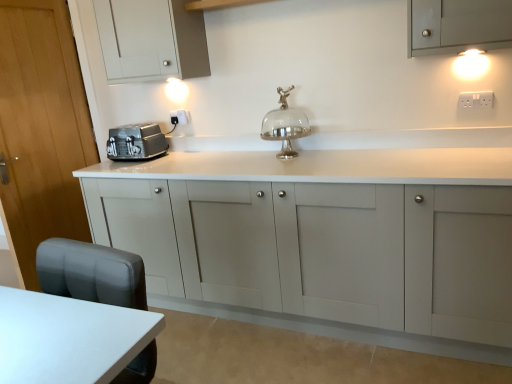
Question: Can you confirm if white plastic electric outlet at upper right, which ranks as the first electric outlet in front-to-back order, is wider than satin silver toaster at left?

Choices:
 (A) no
 (B) yes

Answer: (A)

Question: Considering the relative positions of white plastic electric outlet at upper right, which is the first electric outlet from right to left, and satin silver toaster at left in the image provided, is white plastic electric outlet at upper right, which is the first electric outlet from right to left, to the left of satin silver toaster at left from the viewer's perspective?

Choices:
 (A) yes
 (B) no

Answer: (B)

Question: Considering the relative sizes of white plastic electric outlet at upper right, the second electric outlet from the back, and satin silver toaster at left in the image provided, is white plastic electric outlet at upper right, the second electric outlet from the back, smaller than satin silver toaster at left?

Choices:
 (A) yes
 (B) no

Answer: (A)

Question: Considering the relative sizes of white plastic electric outlet at upper right, which ranks as the first electric outlet in front-to-back order, and satin silver toaster at left in the image provided, is white plastic electric outlet at upper right, which ranks as the first electric outlet in front-to-back order, thinner than satin silver toaster at left?

Choices:
 (A) no
 (B) yes

Answer: (B)

Question: Is there a large distance between white plastic electric outlet at upper right, the 2th electric outlet in the left-to-right sequence, and satin silver toaster at left?

Choices:
 (A) yes
 (B) no

Answer: (A)

Question: From a real-world perspective, is white plastic electric outlet at upper right, the 2th electric outlet in the left-to-right sequence, physically below satin silver toaster at left?

Choices:
 (A) yes
 (B) no

Answer: (B)

Question: From a real-world perspective, is satin silver toaster at left on top of white plastic electric outlet at upper right, which ranks as the first electric outlet in front-to-back order?

Choices:
 (A) no
 (B) yes

Answer: (A)

Question: Is satin silver toaster at left positioned beyond the bounds of white plastic electric outlet at upper right, which ranks as the first electric outlet in front-to-back order?

Choices:
 (A) no
 (B) yes

Answer: (B)

Question: Does satin silver toaster at left lie in front of white plastic electric outlet at upper right, the 2th electric outlet in the left-to-right sequence?

Choices:
 (A) yes
 (B) no

Answer: (B)

Question: From a real-world perspective, is satin silver toaster at left physically below white plastic electric outlet at upper right, the 2th electric outlet in the left-to-right sequence?

Choices:
 (A) no
 (B) yes

Answer: (B)

Question: Does satin silver toaster at left have a greater height compared to white plastic electric outlet at upper right, the second electric outlet from the back?

Choices:
 (A) no
 (B) yes

Answer: (B)

Question: Considering the relative positions of satin silver toaster at left and white plastic electric outlet at upper right, which ranks as the first electric outlet in front-to-back order, in the image provided, is satin silver toaster at left to the left of white plastic electric outlet at upper right, which ranks as the first electric outlet in front-to-back order, from the viewer's perspective?

Choices:
 (A) yes
 (B) no

Answer: (A)

Question: Considering the relative sizes of white plastic electric outlet at upper right, the second electric outlet from the back, and matte gray cabinet at center, positioned as the 1th cabinetry in bottom-to-top order, in the image provided, is white plastic electric outlet at upper right, the second electric outlet from the back, shorter than matte gray cabinet at center, positioned as the 1th cabinetry in bottom-to-top order,?

Choices:
 (A) no
 (B) yes

Answer: (B)